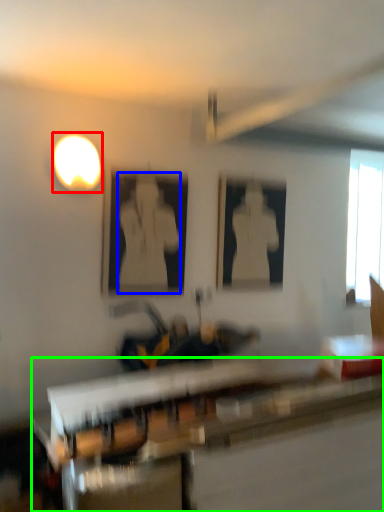
Question: Which is nearer to the light (highlighted by a red box)? person (highlighted by a blue box) or table (highlighted by a green box).

Choices:
 (A) person
 (B) table

Answer: (A)